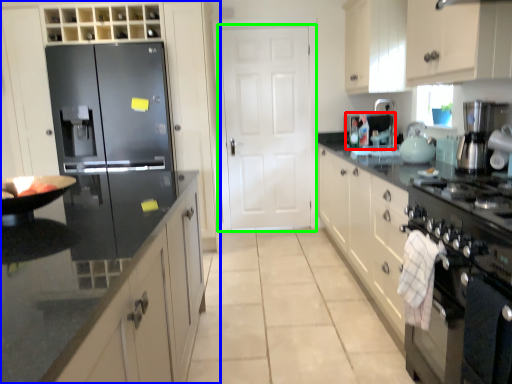
Question: Which object is the farthest from appliance (highlighted by a red box)? Choose among these: cabinetry (highlighted by a blue box) or door (highlighted by a green box).

Choices:
 (A) cabinetry
 (B) door

Answer: (A)